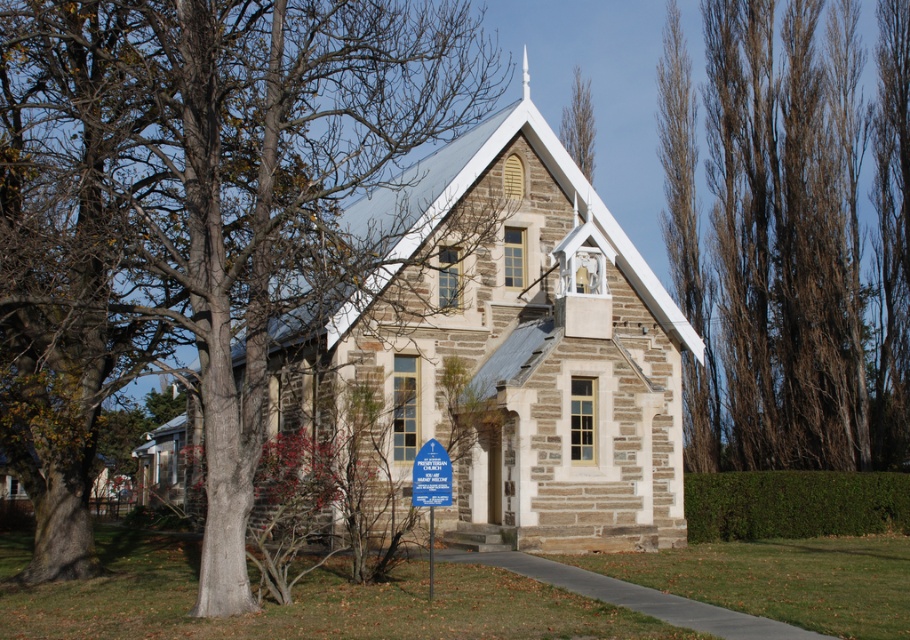
Question: Which object appears farthest from the camera in this image?

Choices:
 (A) white stone spire at upper center
 (B) brown bark tree at upper right
 (C) brown bark tree at left

Answer: (B)

Question: Which of the following is the closest to the observer?

Choices:
 (A) (838, 355)
 (B) (431, 477)
 (C) (435, 493)
 (D) (480, 108)

Answer: (C)

Question: Which point is closer to the camera?

Choices:
 (A) (579, 147)
 (B) (678, 28)

Answer: (A)

Question: Does brown textured bark at upper right appear on the left side of white stone spire at upper center?

Choices:
 (A) no
 (B) yes

Answer: (A)

Question: Can you confirm if stone chapel at center is wider than blue plastic sign at center?

Choices:
 (A) yes
 (B) no

Answer: (A)

Question: Observing the image, what is the correct spatial positioning of brown bark tree at left in reference to blue plastic sign at lower center?

Choices:
 (A) below
 (B) above

Answer: (B)